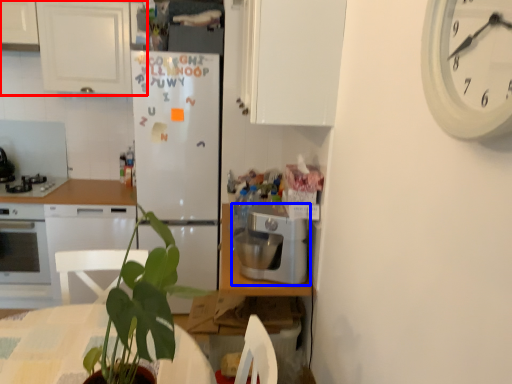
Question: Which point is further to the camera, cabinetry (highlighted by a red box) or kitchen appliance (highlighted by a blue box)?

Choices:
 (A) cabinetry
 (B) kitchen appliance

Answer: (A)